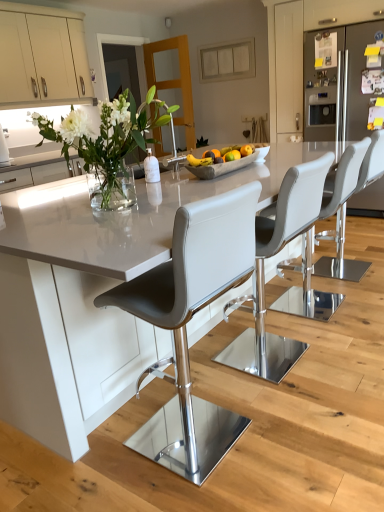
Identify the location of free area in between white leather bar stool at center, which ranks as the 3th chair in back-to-front order, and matte gray bar stool at center, positioned as the fourth chair in back-to-front order. Image resolution: width=384 pixels, height=512 pixels. (246, 394).